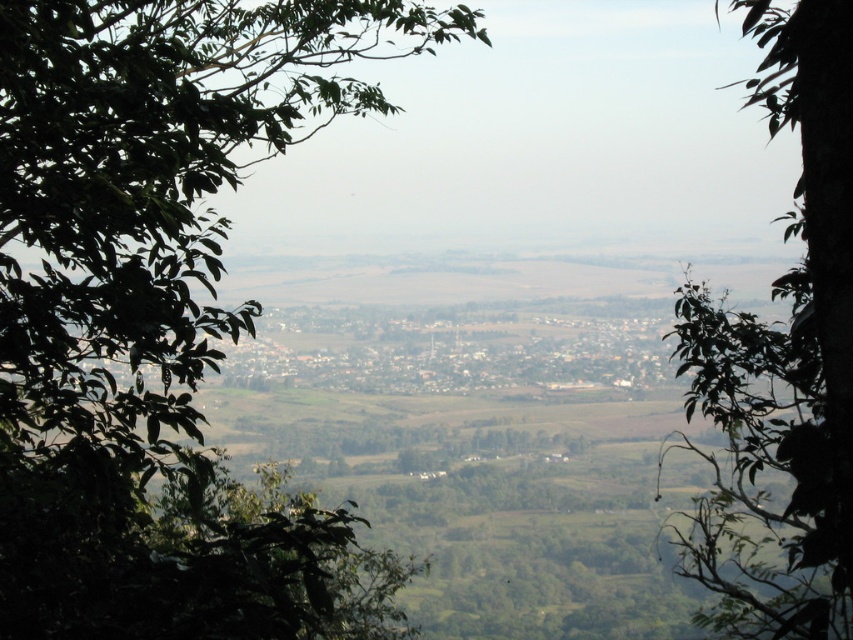
Question: Is green leafy tree at left positioned before green leafy tree at center?

Choices:
 (A) yes
 (B) no

Answer: (B)

Question: Which of the following is the closest to the observer?

Choices:
 (A) green leafy tree at center
 (B) green leafy tree at left

Answer: (A)

Question: Which point is farther to the camera?

Choices:
 (A) (107, 166)
 (B) (785, 376)

Answer: (B)

Question: Is green leafy tree at left in front of green leafy tree at center?

Choices:
 (A) no
 (B) yes

Answer: (A)

Question: Is green leafy tree at left to the left of green leafy tree at center from the viewer's perspective?

Choices:
 (A) no
 (B) yes

Answer: (B)